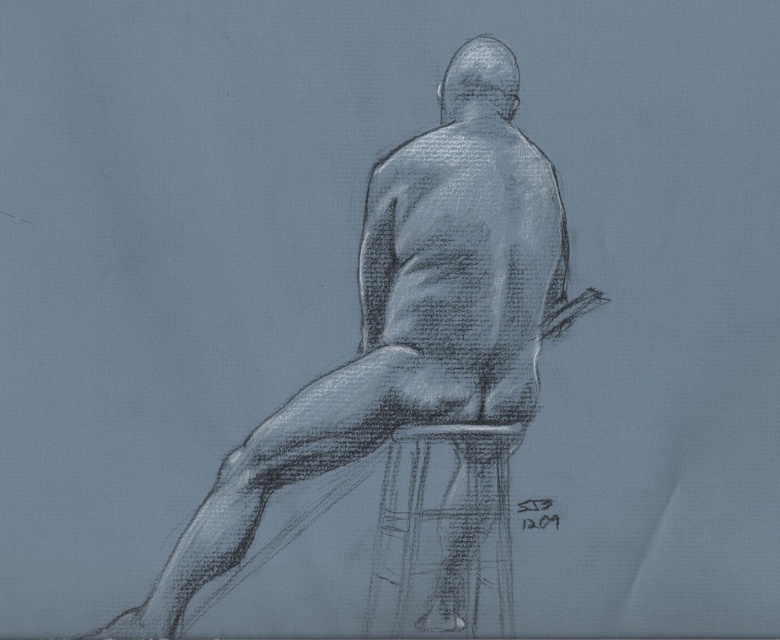
Question: Which of the following is the farthest from the observer?

Choices:
 (A) (431, 611)
 (B) (91, 634)

Answer: (A)

Question: Can you confirm if charcoal figure at center is positioned to the left of charcoal textured stool at center?

Choices:
 (A) yes
 (B) no

Answer: (A)

Question: Does charcoal figure at center appear under charcoal textured stool at center?

Choices:
 (A) yes
 (B) no

Answer: (B)

Question: Is charcoal figure at center wider than charcoal textured stool at center?

Choices:
 (A) yes
 (B) no

Answer: (A)

Question: Which object is closer to the camera taking this photo?

Choices:
 (A) charcoal textured stool at center
 (B) charcoal figure at center

Answer: (B)